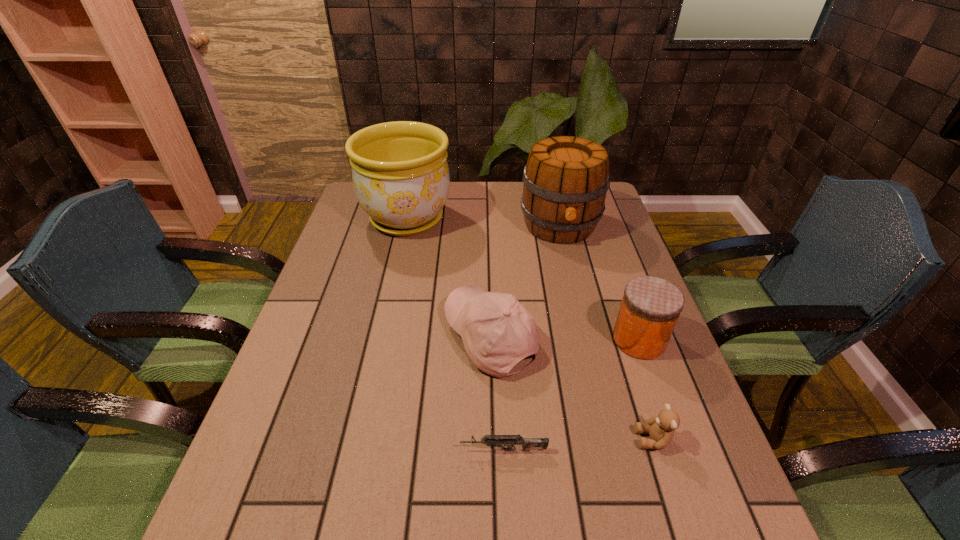
This screenshot has width=960, height=540. I want to click on free space located 0.190m on the front-facing side of the baseball cap, so click(367, 338).

Identify the location of free space located 0.200m on the front-facing side of the baseball cap. This screenshot has width=960, height=540. (363, 338).

Identify the location of free space located on the front-facing side of the teddy bear. (442, 440).

Locate an element on the screen. The width and height of the screenshot is (960, 540). free space located 0.150m on the front-facing side of the teddy bear is located at coordinates (562, 440).

I want to click on vacant space located on the front-facing side of the teddy bear, so click(467, 440).

In order to click on vacant space located 0.170m aimed along the barrel of the gun in this screenshot , I will do `click(373, 450)`.

Locate an element on the screen. The width and height of the screenshot is (960, 540). free space located 0.300m aimed along the barrel of the gun is located at coordinates (308, 450).

The image size is (960, 540). I want to click on vacant area situated 0.240m aimed along the barrel of the gun, so click(x=338, y=450).

The width and height of the screenshot is (960, 540). Find the location of `flowerpot that is at the far edge`. flowerpot that is at the far edge is located at coordinates tap(400, 173).

In order to click on cider that is at the far edge in this screenshot , I will do `click(566, 179)`.